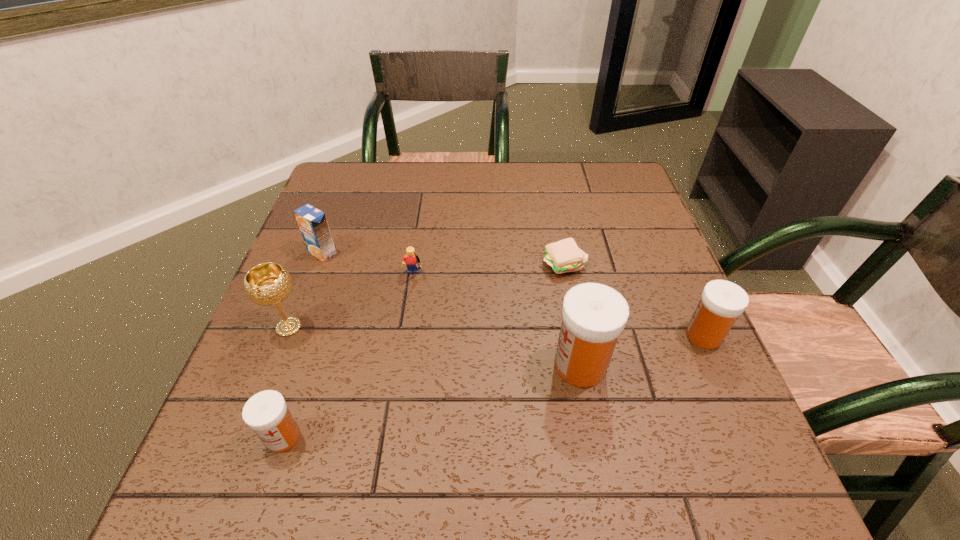
At what (x,y) coordinates should I click in order to perform the action: click on the nearest medicine. Please return your answer as a coordinate pair (x, y). This screenshot has width=960, height=540. Looking at the image, I should click on (266, 413).

I want to click on the leftmost medicine, so click(x=266, y=413).

Locate an element on the screen. the second medicine from right to left is located at coordinates (594, 315).

Identify the location of the rightmost medicine. (721, 303).

At what (x,y) coordinates should I click in order to perform the action: click on the second shortest medicine. Please return your answer as a coordinate pair (x, y). The image size is (960, 540). Looking at the image, I should click on (721, 303).

At what (x,y) coordinates should I click in order to perform the action: click on orange_juice. Please return your answer as a coordinate pair (x, y). The image size is (960, 540). Looking at the image, I should click on (312, 222).

Identify the location of the fourth object from right to left. The image size is (960, 540). (411, 260).

Where is `patty`? patty is located at coordinates (563, 256).

At what (x,y) coordinates should I click in order to perform the action: click on chalice. Please return your answer as a coordinate pair (x, y). Looking at the image, I should click on pyautogui.click(x=266, y=284).

At what (x,y) coordinates should I click in order to perform the action: click on vacant space located 0.090m on the right of the leftmost medicine. Please return your answer as a coordinate pair (x, y). This screenshot has width=960, height=540. Looking at the image, I should click on (353, 437).